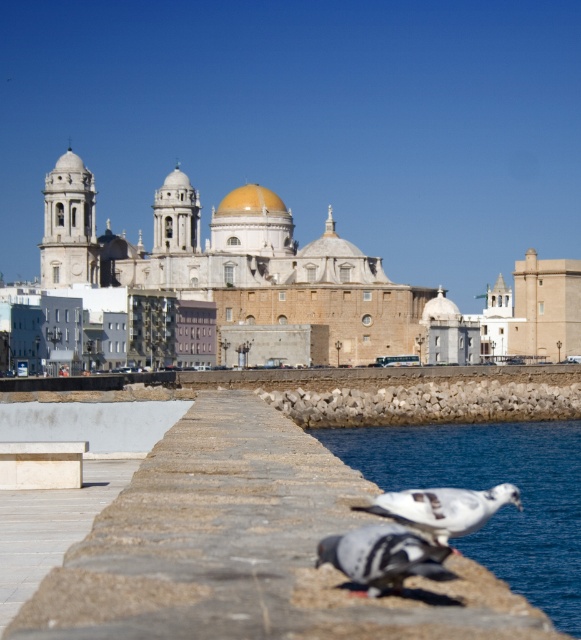
You are standing on the stone walkway and want to observe both the blue water at lower right and the white matte pigeon at lower center. Which object appears closer to your eye level?

The white matte pigeon at lower center appears closer to your eye level because it is shorter than the blue water at lower right, which is much taller.

You are standing on the walkway and want to see the blue water at lower right. Which direction should you look to see it?

You should look towards the lower right direction to see the blue water at lower right.

You are standing on the walkway and want to get to the blue water at lower right. Which direction should you walk relative to the gray matte pigeon at lower center?

You should walk to the right of the gray matte pigeon at lower center to reach the blue water at lower right since it is located to the right of the pigeon.